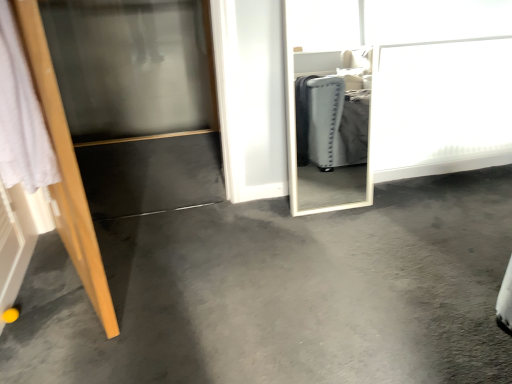
Question: Is white glossy screen door at upper right, which appears as the 2th screen door when viewed from the left, thinner than wooden door at left?

Choices:
 (A) no
 (B) yes

Answer: (B)

Question: Considering the relative sizes of white glossy screen door at upper right, which appears as the 2th screen door when viewed from the left, and wooden door at left in the image provided, is white glossy screen door at upper right, which appears as the 2th screen door when viewed from the left, bigger than wooden door at left?

Choices:
 (A) no
 (B) yes

Answer: (A)

Question: Is white glossy screen door at upper right, which appears as the 2th screen door when viewed from the left, looking in the opposite direction of wooden door at left?

Choices:
 (A) no
 (B) yes

Answer: (A)

Question: Considering the relative sizes of white glossy screen door at upper right, which appears as the 2th screen door when viewed from the left, and wooden door at left in the image provided, is white glossy screen door at upper right, which appears as the 2th screen door when viewed from the left, wider than wooden door at left?

Choices:
 (A) no
 (B) yes

Answer: (A)

Question: Is white glossy screen door at upper right, the 1th screen door positioned from the right, facing towards wooden door at left?

Choices:
 (A) yes
 (B) no

Answer: (B)

Question: From the image's perspective, would you say white glossy screen door at upper right, which appears as the 2th screen door when viewed from the left, is shown under wooden door at left?

Choices:
 (A) no
 (B) yes

Answer: (A)

Question: From a real-world perspective, is white glossy screen door at upper right, which appears as the 2th screen door when viewed from the left, physically below gray carpet at center?

Choices:
 (A) yes
 (B) no

Answer: (B)

Question: Considering the relative sizes of white glossy screen door at upper right, which appears as the 2th screen door when viewed from the left, and gray carpet at center in the image provided, is white glossy screen door at upper right, which appears as the 2th screen door when viewed from the left, shorter than gray carpet at center?

Choices:
 (A) yes
 (B) no

Answer: (B)

Question: Is white glossy screen door at upper right, which appears as the 2th screen door when viewed from the left, to the right of gray carpet at center from the viewer's perspective?

Choices:
 (A) no
 (B) yes

Answer: (B)

Question: From the image's perspective, would you say white glossy screen door at upper right, which appears as the 2th screen door when viewed from the left, is positioned over gray carpet at center?

Choices:
 (A) no
 (B) yes

Answer: (B)

Question: Can you confirm if white glossy screen door at upper right, which appears as the 2th screen door when viewed from the left, is taller than gray carpet at center?

Choices:
 (A) no
 (B) yes

Answer: (B)

Question: Is white glossy screen door at upper right, which appears as the 2th screen door when viewed from the left, looking in the opposite direction of gray carpet at center?

Choices:
 (A) yes
 (B) no

Answer: (B)

Question: Is wooden door at left directly adjacent to gray carpet at center?

Choices:
 (A) yes
 (B) no

Answer: (B)